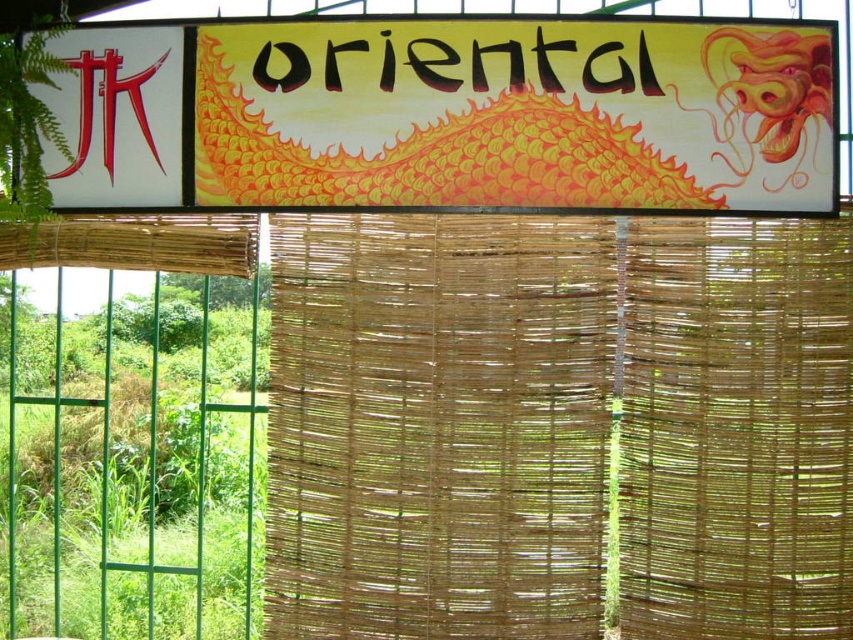
The height and width of the screenshot is (640, 853). In order to click on natural woven bamboo at center in this screenshot , I will do `click(560, 426)`.

Between natural woven bamboo at center and blackmaterial/texture at upper center, which one is positioned higher?

blackmaterial/texture at upper center is above.

Between point (778, 259) and point (329, 58), which one is positioned behind?

Point (329, 58)

Locate an element on the screen. natural woven bamboo at center is located at coordinates (560, 426).

Is natural woven bamboo at center taller than matte yellow dragon at upper center?

Yes, natural woven bamboo at center is taller than matte yellow dragon at upper center.

Which is in front, point (349, 333) or point (766, 60)?

Point (766, 60)

Where is `natural woven bamboo at center`? natural woven bamboo at center is located at coordinates (560, 426).

Between point (282, 70) and point (627, 61), which one is positioned behind?

Point (282, 70)

Which is more to the left, matte yellow dragon at upper center or blackmaterial/texture at upper center?

matte yellow dragon at upper center is more to the left.

The height and width of the screenshot is (640, 853). In order to click on matte yellow dragon at upper center in this screenshot , I will do `click(448, 115)`.

Locate an element on the screen. The height and width of the screenshot is (640, 853). matte yellow dragon at upper center is located at coordinates (448, 115).